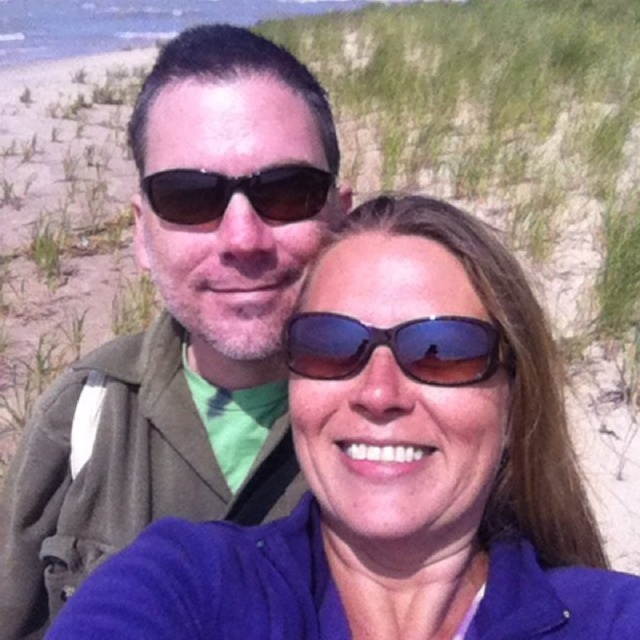
Question: Is matte green jacket at center closer to the viewer compared to blue reflective sunglasses at center?

Choices:
 (A) yes
 (B) no

Answer: (B)

Question: Which object is farther from the camera taking this photo?

Choices:
 (A) matte black sunglasses at upper center
 (B) blue fabric at center
 (C) matte green jacket at center

Answer: (C)

Question: Based on their relative distances, which object is farther from the matte green jacket at center?

Choices:
 (A) blue reflective sunglasses at center
 (B) blue fabric at center

Answer: (B)

Question: Which point is closer to the camera taking this photo?

Choices:
 (A) (273, 547)
 (B) (160, 202)

Answer: (A)

Question: Is blue fabric at center to the right of matte black sunglasses at upper center from the viewer's perspective?

Choices:
 (A) yes
 (B) no

Answer: (A)

Question: Where is blue fabric at center located in relation to matte green jacket at center in the image?

Choices:
 (A) above
 (B) below

Answer: (B)